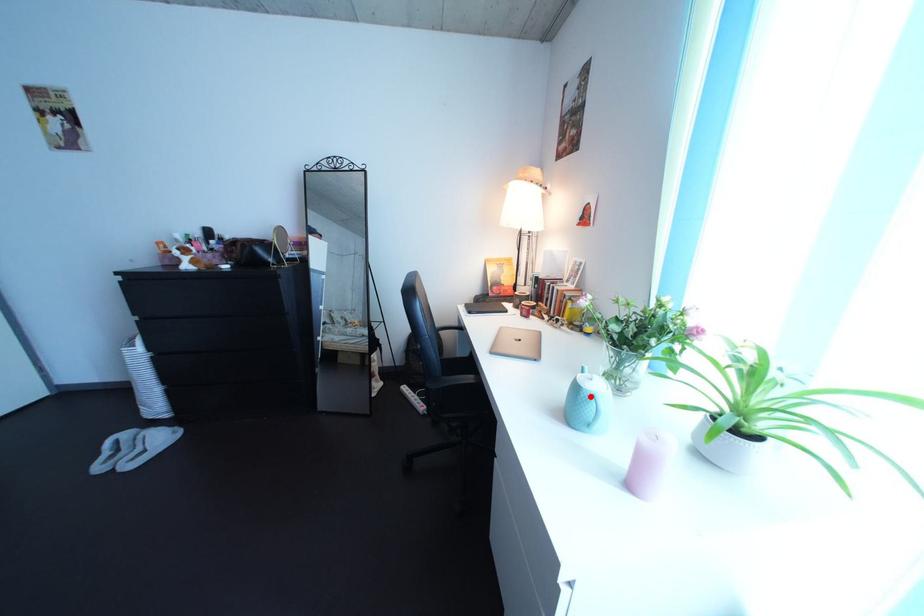
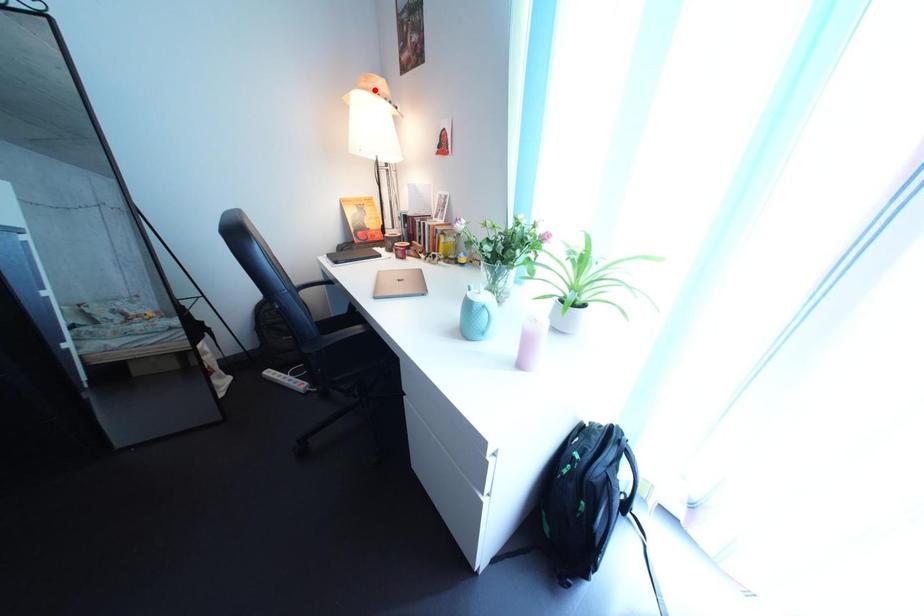
I am providing you with two images of the same scene from different viewpoints. A red point is marked on the first image and another point is marked on the second image. Is the red point in image1 aligned with the point shown in image2?

No